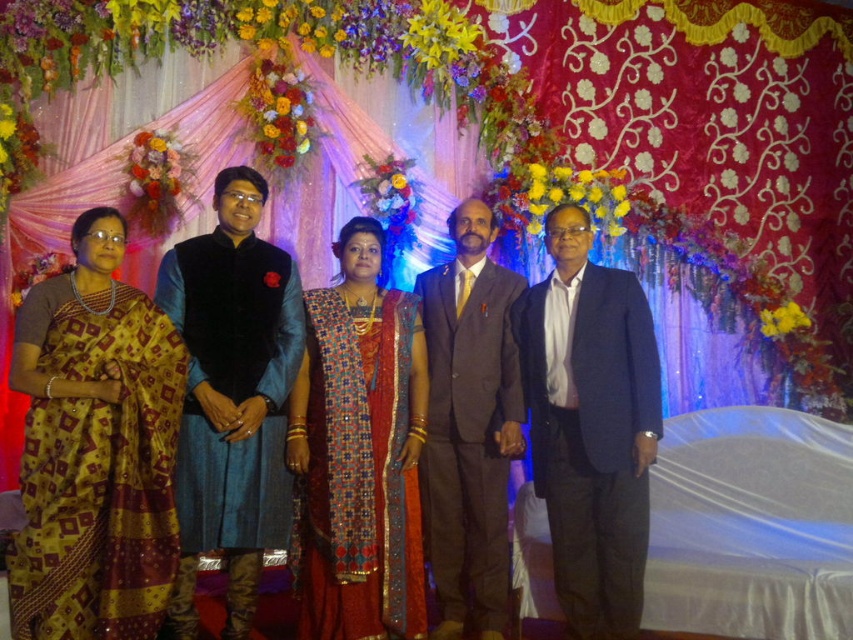
You are a photographer at the event and want to ensure that both the yellow silk saree at left and the matte brown suit at center are clearly visible in the photo. Based on their positions, which one might be more visible to the camera positioned at the front of the stage?

The yellow silk saree at left is positioned over the matte brown suit at center, so it will likely be more visible to the camera as it is in a forward position.

In the festive scene with the yellow silk saree at left and the matte brown suit at center, which object is positioned to the right of the other?

The matte brown suit at center is positioned to the right of the yellow silk saree at left.

Looking at this image, you are a photographer trying to adjust the framing of the image. The red silk saree at center and the navy blue suit at center are both in the center. Which one appears wider in the photo?

The red silk saree at center appears wider than the navy blue suit at center because its width surpasses the navy blue suit at center.